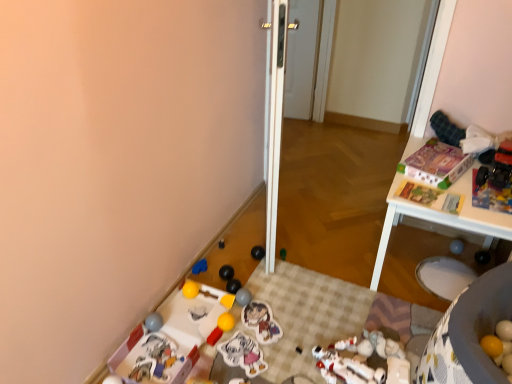
Where is `free spot behind matte plastic sticker at center, marked as the seventh toy in a right-to-left arrangement`? free spot behind matte plastic sticker at center, marked as the seventh toy in a right-to-left arrangement is located at coordinates (266, 291).